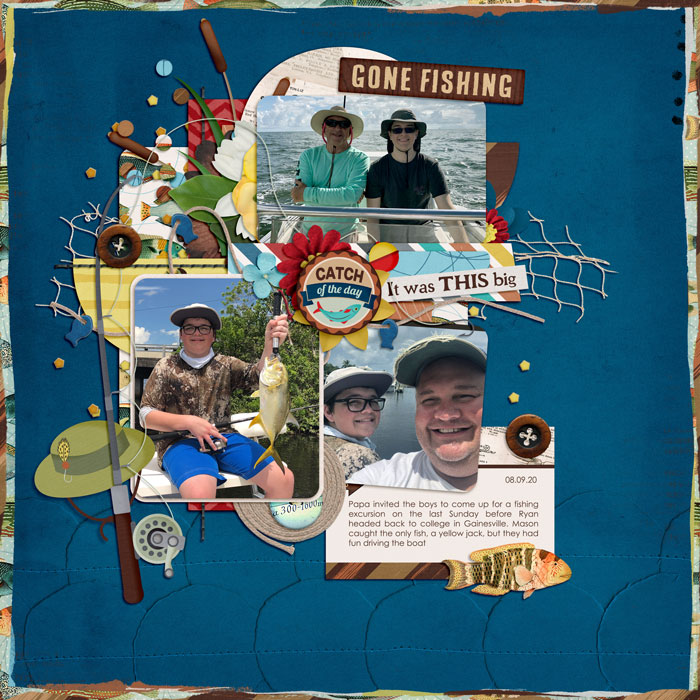
Locate an element on the screen. photographs is located at coordinates (400, 427), (228, 427), (383, 138).